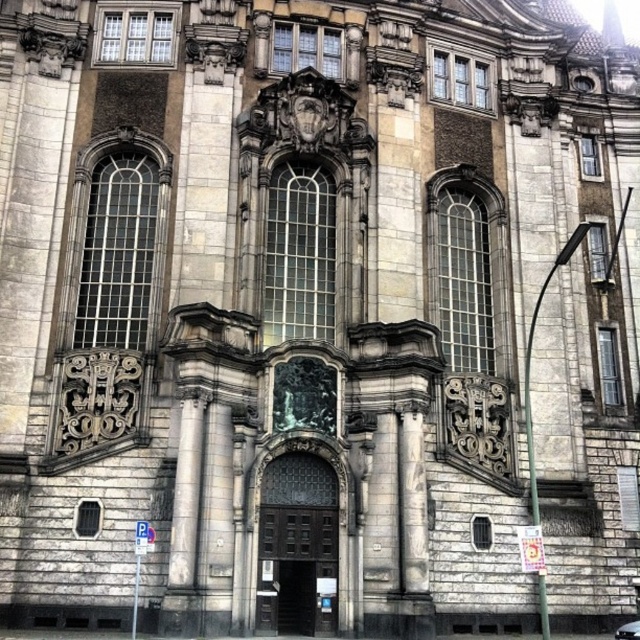
Question: Does white marble column at center appear over metallic silver car at center?

Choices:
 (A) no
 (B) yes

Answer: (B)

Question: Does white marble column at center have a lesser width compared to metallic silver car at center?

Choices:
 (A) no
 (B) yes

Answer: (B)

Question: Does white marble column at center appear on the right side of metallic silver car at center?

Choices:
 (A) yes
 (B) no

Answer: (B)

Question: Which of the following is the closest to the observer?

Choices:
 (A) (620, 627)
 (B) (397, 476)

Answer: (B)